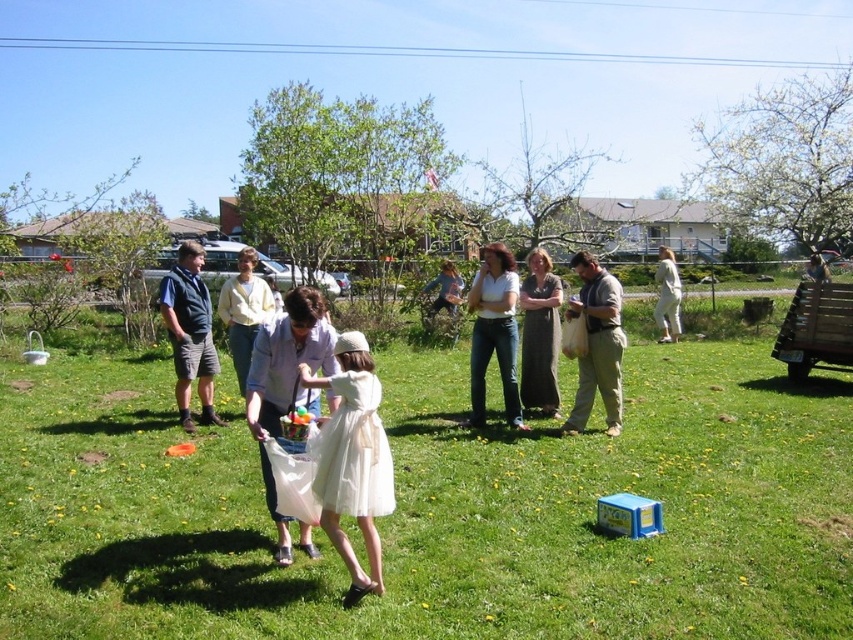
Based on the photo, does white matte plastic bag at center lie in front of white tulle dress at center?

No, it is behind white tulle dress at center.

How distant is white matte plastic bag at center from white tulle dress at center?

white matte plastic bag at center is 16.21 inches from white tulle dress at center.

What do you see at coordinates (286, 385) in the screenshot?
I see `white matte plastic bag at center` at bounding box center [286, 385].

Image resolution: width=853 pixels, height=640 pixels. What are the coordinates of `white matte plastic bag at center` in the screenshot? It's located at (286, 385).

Between denim jeans at center and dark blue vest at center, which one has more height?

Standing taller between the two is denim jeans at center.

Can you confirm if denim jeans at center is shorter than dark blue vest at center?

In fact, denim jeans at center may be taller than dark blue vest at center.

Locate an element on the screen. denim jeans at center is located at coordinates (494, 332).

Who is positioned more to the right, dark blue vest at center or light yellow sweater at center?

light yellow sweater at center

Is the position of dark blue vest at center less distant than that of light yellow sweater at center?

Yes, it is in front of light yellow sweater at center.

Measure the distance between point (199,289) and camera.

Point (199,289) is 7.60 meters away from camera.

The width and height of the screenshot is (853, 640). What are the coordinates of `dark blue vest at center` in the screenshot? It's located at (190, 332).